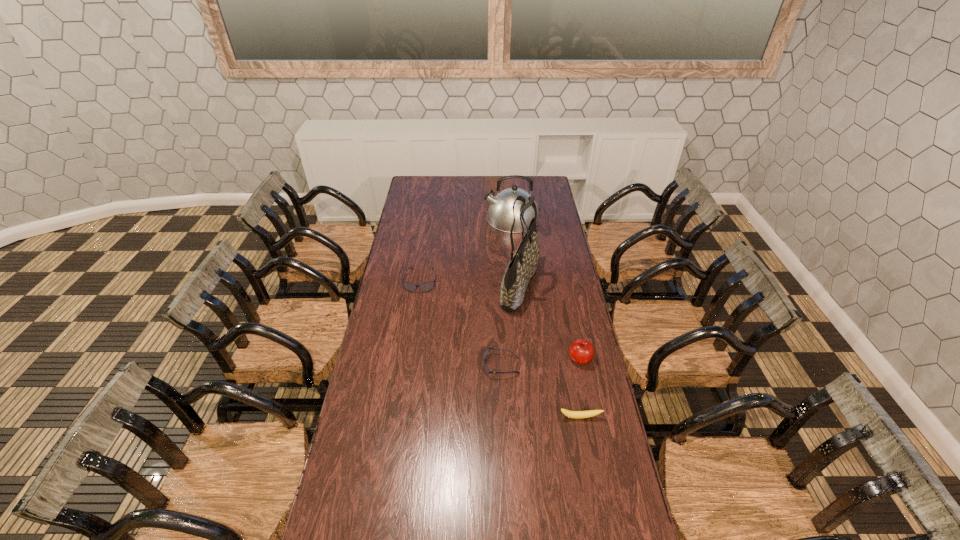
You are a GUI agent. You are given a task and a screenshot of the screen. Output one action in this format:
    pyautogui.click(x=<x>, y=<y>)
    Task: Click on the empty space between the tallest object and the fourth shortest object
    
    Given the screenshot: What is the action you would take?
    [550, 322]

You are a GUI agent. You are given a task and a screenshot of the screen. Output one action in this format:
    pyautogui.click(x=<x>, y=<y>)
    Task: Click on the unoccupied position between the farthest object and the apple
    The width and height of the screenshot is (960, 540).
    Given the screenshot: What is the action you would take?
    pyautogui.click(x=546, y=288)

Locate an element on the screen. vacant region between the second tallest object and the leftmost object is located at coordinates (467, 249).

Where is `free area in between the banana and the fourth shortest object`? free area in between the banana and the fourth shortest object is located at coordinates (580, 388).

Where is `unoccupied position between the nearer sunglasses and the nearest object`? unoccupied position between the nearer sunglasses and the nearest object is located at coordinates (540, 391).

This screenshot has width=960, height=540. Find the location of `unoccupied position between the second tallest object and the nearest object`. unoccupied position between the second tallest object and the nearest object is located at coordinates (546, 318).

The image size is (960, 540). I want to click on empty location between the nearest object and the tote bag, so click(x=550, y=352).

Locate which object is the second closest to the third tallest object. Please provide its 2D coordinates. Your answer should be formatted as a tuple, i.e. [(x, y)], where the tuple contains the x and y coordinates of a point satisfying the conditions above.

[(571, 414)]

Select which object is the fourth closest to the leftmost object. Please provide its 2D coordinates. Your answer should be formatted as a tuple, i.e. [(x, y)], where the tuple contains the x and y coordinates of a point satisfying the conditions above.

[(581, 351)]

Where is `free location that satisfies the following two spatial constraints: 1. on the lenses of the left sunglasses; 2. on the left side of the tallest object`? Image resolution: width=960 pixels, height=540 pixels. free location that satisfies the following two spatial constraints: 1. on the lenses of the left sunglasses; 2. on the left side of the tallest object is located at coordinates (420, 286).